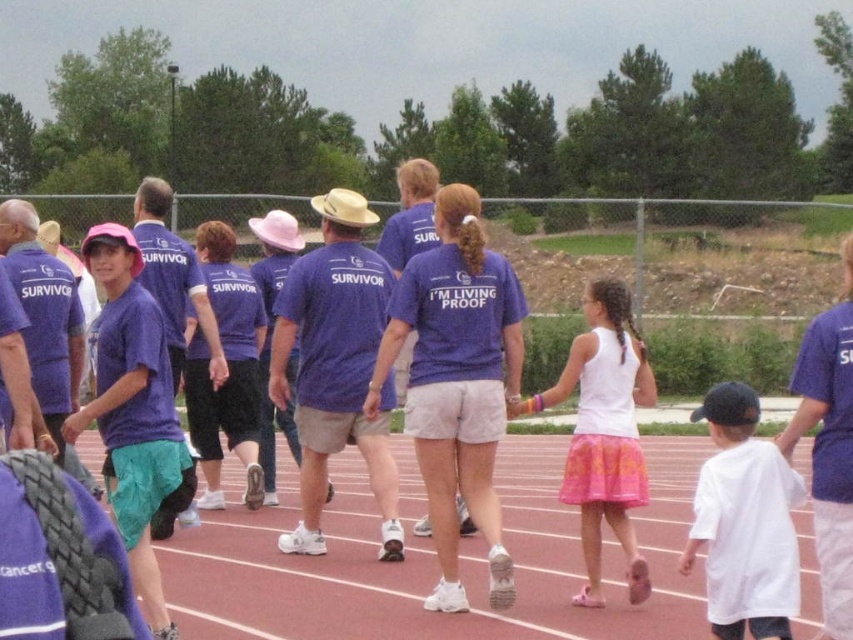
You are a photographer taking a picture of the matte purple shirt at center and the white cotton tank top at center. Which one will appear taller in the photo?

The matte purple shirt at center appears taller in the photo because it has a greater height compared to the white cotton tank top at center.